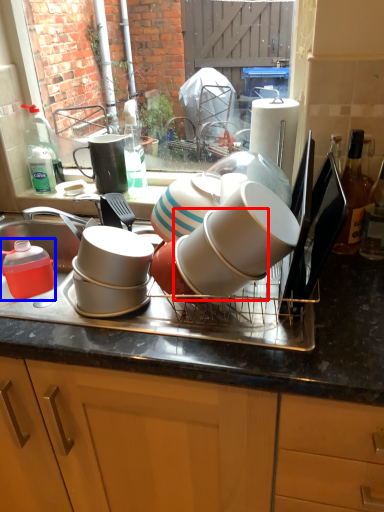
Question: Which object appears farthest to the camera in this image, tableware (highlighted by a red box) or tableware (highlighted by a blue box)?

Choices:
 (A) tableware
 (B) tableware

Answer: (B)